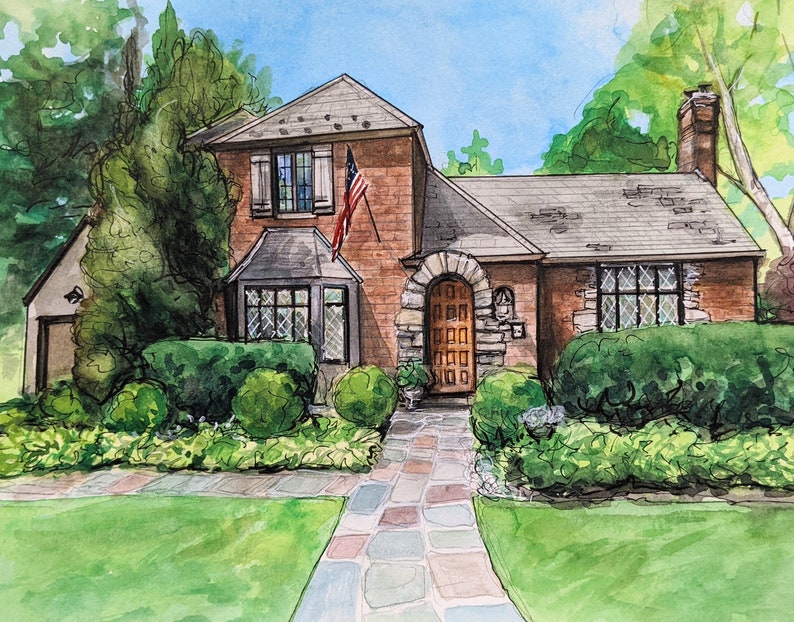
I want to click on chimney, so click(703, 114).